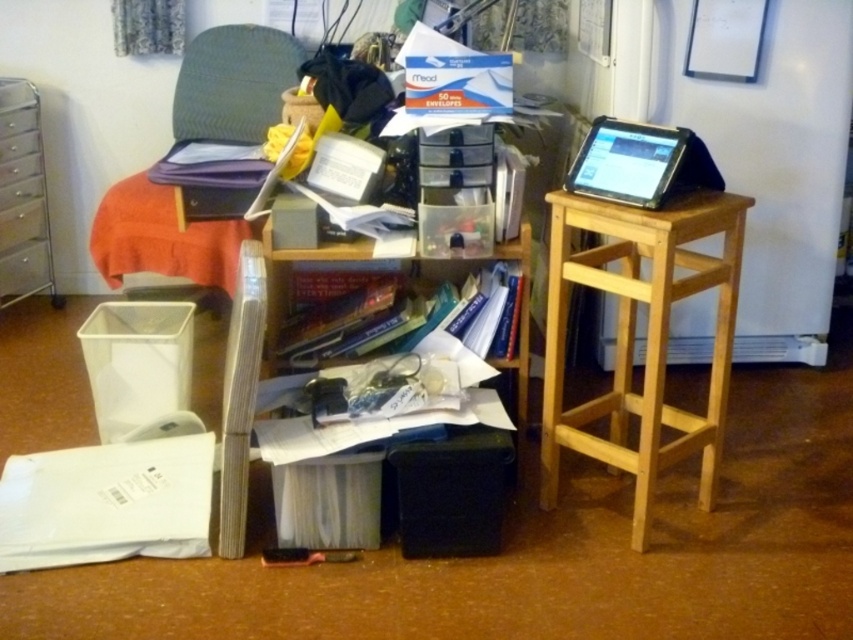
From the picture: Does metallic silver file cabinet at left come behind black matte tablet at upper right?

Yes, it is behind black matte tablet at upper right.

What do you see at coordinates (22, 196) in the screenshot?
I see `metallic silver file cabinet at left` at bounding box center [22, 196].

At what (x,y) coordinates should I click in order to perform the action: click on metallic silver file cabinet at left. Please return your answer as a coordinate pair (x, y). This screenshot has height=640, width=853. Looking at the image, I should click on (22, 196).

Is the position of textured fabric chair at upper left more distant than that of black matte tablet at upper right?

Yes, textured fabric chair at upper left is further from the viewer.

Is textured fabric chair at upper left taller than black matte tablet at upper right?

Yes.

Is point (187, 44) closer to camera compared to point (595, 166)?

No, (187, 44) is further to viewer.

This screenshot has height=640, width=853. Find the location of `textured fabric chair at upper left`. textured fabric chair at upper left is located at coordinates (233, 83).

Does natural wood side table at right appear on the right side of textured fabric chair at upper left?

Indeed, natural wood side table at right is positioned on the right side of textured fabric chair at upper left.

Between natural wood side table at right and textured fabric chair at upper left, which one is positioned lower?

natural wood side table at right is below.

What do you see at coordinates (633, 336) in the screenshot? The width and height of the screenshot is (853, 640). I see `natural wood side table at right` at bounding box center [633, 336].

Where is `natural wood side table at right`? Image resolution: width=853 pixels, height=640 pixels. natural wood side table at right is located at coordinates (633, 336).